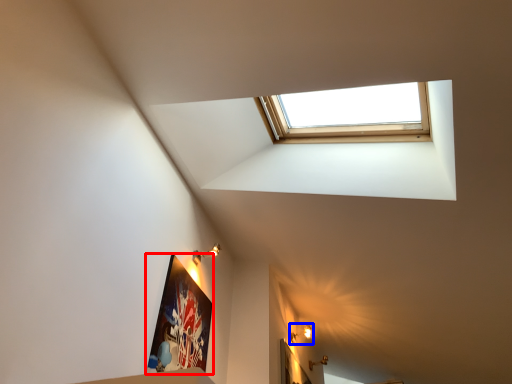
Question: Among these objects, which one is farthest to the camera, picture frame (highlighted by a red box) or light fixture (highlighted by a blue box)?

Choices:
 (A) picture frame
 (B) light fixture

Answer: (B)